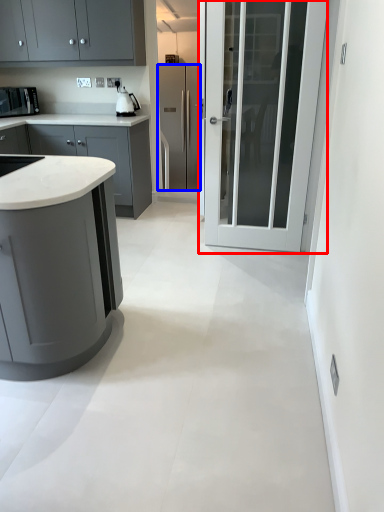
Question: Which object is further to the camera taking this photo, door (highlighted by a red box) or refrigerator (highlighted by a blue box)?

Choices:
 (A) door
 (B) refrigerator

Answer: (B)